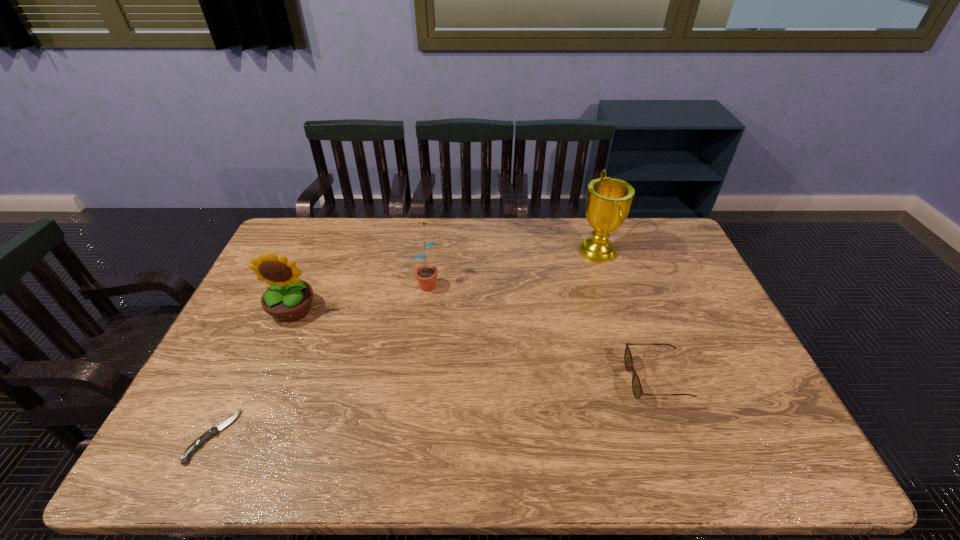
Find the location of a particular element. The height and width of the screenshot is (540, 960). vacant space that is in between the second shortest object and the shortest object is located at coordinates (434, 408).

The image size is (960, 540). I want to click on free spot between the award and the second nearest object, so click(627, 316).

Image resolution: width=960 pixels, height=540 pixels. In order to click on empty location between the spectacles and the award in this screenshot , I will do `click(627, 316)`.

You are a GUI agent. You are given a task and a screenshot of the screen. Output one action in this format:
    pyautogui.click(x=<x>, y=<y>)
    Task: Click on the free space that is in between the third object from right to left and the award
    The width and height of the screenshot is (960, 540).
    Given the screenshot: What is the action you would take?
    pyautogui.click(x=513, y=267)

Identify the location of free point between the right sunflower and the pocketknife. The image size is (960, 540). (321, 359).

This screenshot has width=960, height=540. Identify the location of free area in between the award and the spectacles. (627, 316).

The width and height of the screenshot is (960, 540). What are the coordinates of `vacant space that is in between the spectacles and the third object from left to right` in the screenshot? It's located at (541, 331).

Find the location of a particular element. the closest object to the second nearest object is located at coordinates (608, 201).

You are a GUI agent. You are given a task and a screenshot of the screen. Output one action in this format:
    pyautogui.click(x=<x>, y=<y>)
    Task: Click on the object that is the fourth closest to the fourth tallest object
    This screenshot has height=540, width=960.
    Given the screenshot: What is the action you would take?
    pyautogui.click(x=214, y=431)

Where is `free space that satisfies the following two spatial constraints: 1. on the shiny surface of the award; 2. on the flower of the right sunflower`? This screenshot has height=540, width=960. free space that satisfies the following two spatial constraints: 1. on the shiny surface of the award; 2. on the flower of the right sunflower is located at coordinates (608, 282).